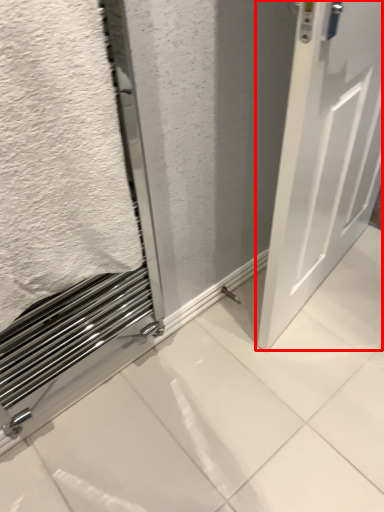
Question: Observing the image, what is the correct spatial positioning of door (annotated by the red box) in reference to bath towel?

Choices:
 (A) left
 (B) right

Answer: (B)